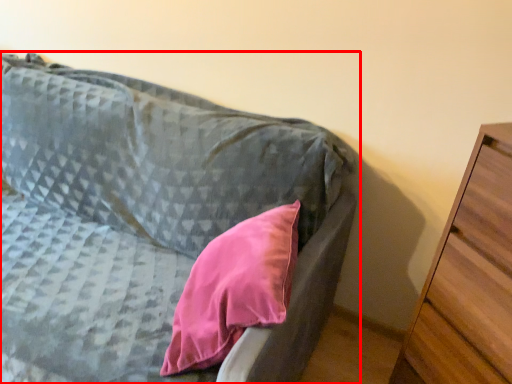
Question: From the image's perspective, what is the correct spatial relationship of furniture (annotated by the red box) in relation to chest of drawers?

Choices:
 (A) below
 (B) above

Answer: (B)